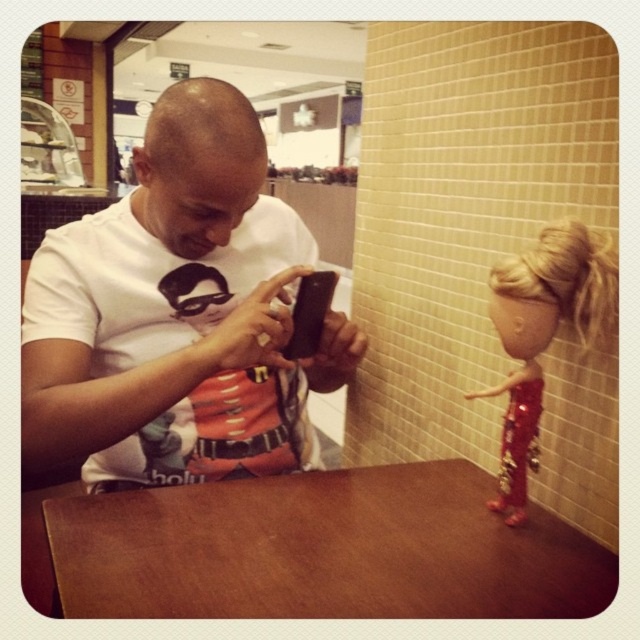
Question: Which point is farther from the camera taking this photo?

Choices:
 (A) (44, 413)
 (B) (508, 280)

Answer: (B)

Question: Can you confirm if brown matte table at lower center is positioned to the left of shiny red fabric doll at right?

Choices:
 (A) no
 (B) yes

Answer: (B)

Question: Can you confirm if brown matte table at lower center is smaller than shiny red fabric doll at right?

Choices:
 (A) yes
 (B) no

Answer: (B)

Question: Among these points, which one is nearest to the camera?

Choices:
 (A) (589, 262)
 (B) (212, 324)
 (C) (490, 566)

Answer: (C)

Question: Which object appears farthest from the camera in this image?

Choices:
 (A) brown matte table at lower center
 (B) white matte shirt at center
 (C) shiny red fabric doll at right

Answer: (C)

Question: Does shiny red fabric doll at right have a greater width compared to black matte smartphone at center?

Choices:
 (A) yes
 (B) no

Answer: (A)